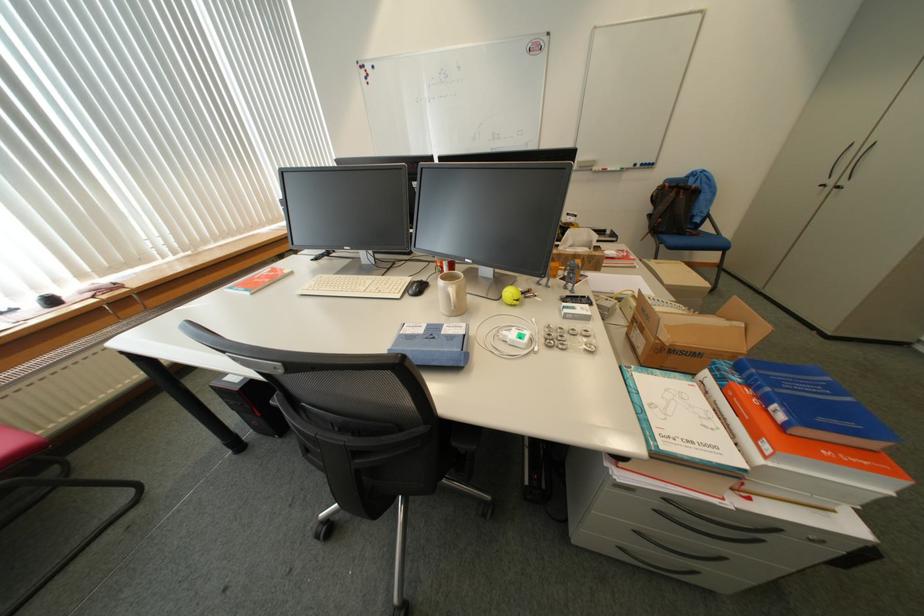
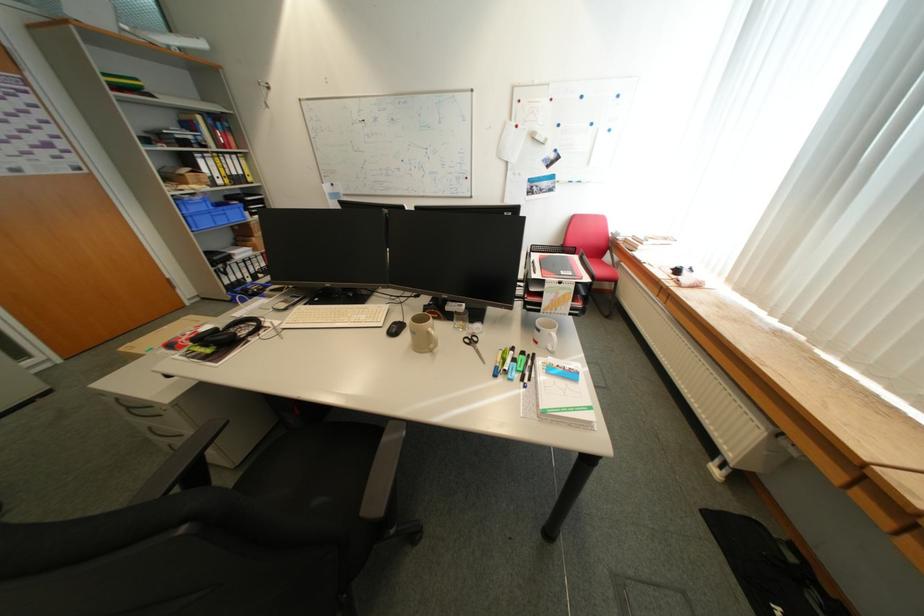
Question: I am providing you with two images of the same scene from different viewpoints. After the viewpoint changes to image2, which objects are now occluded?

Choices:
 (A) blue cardboard box
 (B) green marker
 (C) toaster oven knob
 (D) beige coffee mug

Answer: (A)